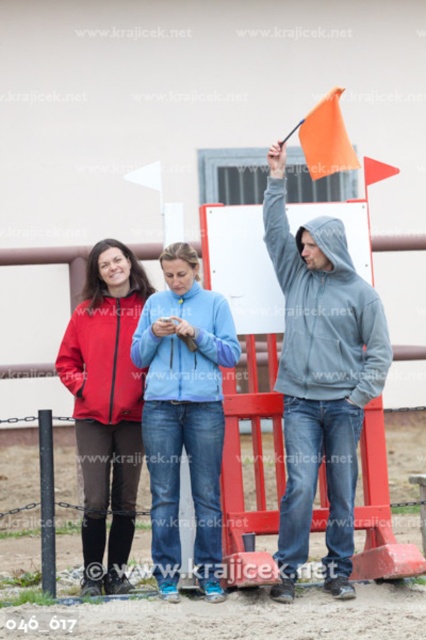
You are standing at the point with coordinates point (325, 312). What are you wearing?

The point (325, 312) corresponds to the gray fleece hoodie at center, so you are wearing a gray fleece hoodie at center.

You are a photographer positioned at the origin point in a coordinate system where the image spans from 0 to 1 in both x and y axes. You need to capture a photo of the gray hoodie at center without moving your camera. What is the exact coordinate where you should aim your camera to ensure the hoodie is centered in the frame?

The gray hoodie at center is located at coordinate point (321,380). To center it in the frame, aim your camera at that exact coordinate.

You are a photographer at the horse riding arena and need to capture both the gray hoodie at center and the light blue fleece jacket at center in the same frame. Your camera has a maximum angle of view that can cover 5 meters between subjects. Can you fit both into the frame?

The gray hoodie at center and the light blue fleece jacket at center are 4.44 meters apart. Since the maximum angle of view can cover 5 meters, the photographer can fit both into the frame as 4.44 meters is less than 5 meters.